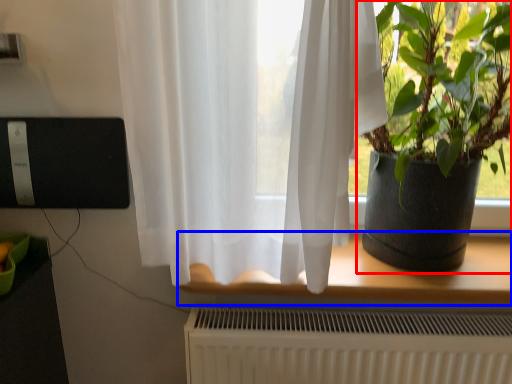
Question: Among these objects, which one is farthest to the camera, houseplant (highlighted by a red box) or window (highlighted by a blue box)?

Choices:
 (A) houseplant
 (B) window

Answer: (B)